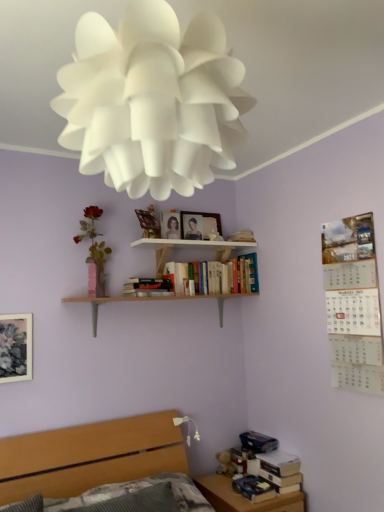
Where is `empty space that is ontop of hardcover book at lower right, the 1th book positioned from the bottom (from a real-world perspective)`? Image resolution: width=384 pixels, height=512 pixels. empty space that is ontop of hardcover book at lower right, the 1th book positioned from the bottom (from a real-world perspective) is located at coordinates (253, 480).